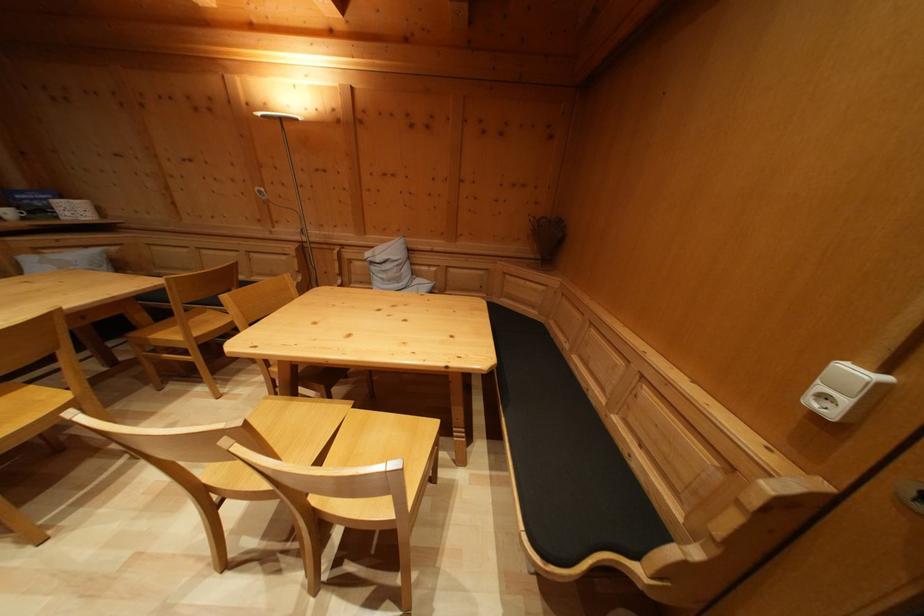
Identify the location of lamp switch. The height and width of the screenshot is (616, 924). (845, 392).